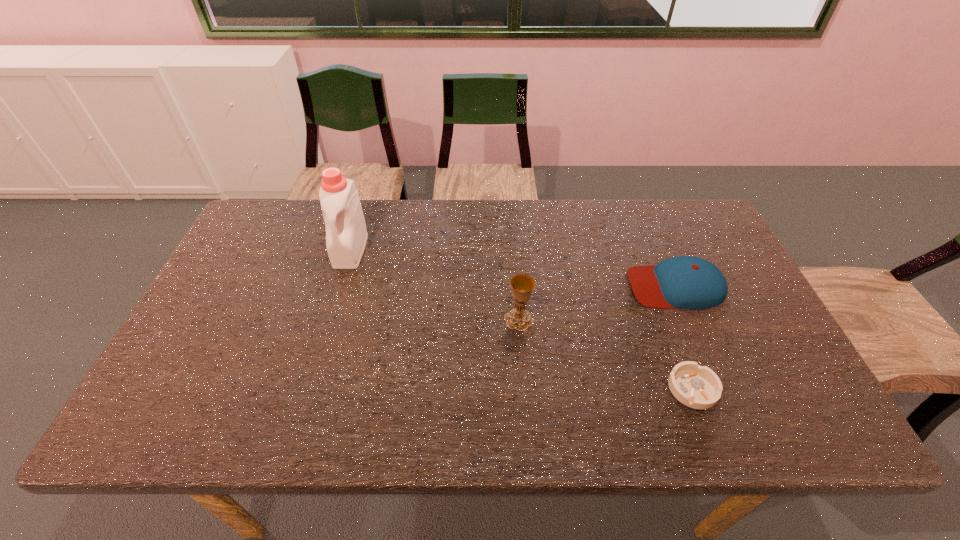
Locate an element on the screen. the leftmost object is located at coordinates (346, 236).

The height and width of the screenshot is (540, 960). I want to click on detergent, so click(x=346, y=236).

Where is `chalice`? chalice is located at coordinates (522, 285).

Locate an element on the screen. Image resolution: width=960 pixels, height=540 pixels. the second object from left to right is located at coordinates tap(522, 285).

Identify the location of baseball cap. This screenshot has width=960, height=540. (685, 282).

Identify the location of ashtray. The width and height of the screenshot is (960, 540). (698, 387).

You are a GUI agent. You are given a task and a screenshot of the screen. Output one action in this format:
    pyautogui.click(x=<x>, y=<y>)
    Task: Click on the shortest object
    The width and height of the screenshot is (960, 540).
    Given the screenshot: What is the action you would take?
    [698, 387]

At what (x,y) coordinates should I click in order to perform the action: click on free location located 0.140m on the handle side of the leftmost object. Please return your answer as a coordinate pair (x, y). This screenshot has height=540, width=960. Looking at the image, I should click on (333, 307).

I want to click on free space located on the front of the second object from left to right, so click(x=521, y=347).

Identify the location of vacant space located with the bill of the baseball cap facing forward. This screenshot has width=960, height=540. (521, 286).